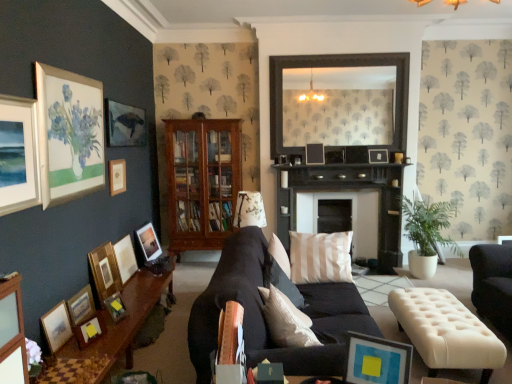
Where is `wooden picture frame at lower left, acting as the 3th picture frame starting from the left`? This screenshot has height=384, width=512. wooden picture frame at lower left, acting as the 3th picture frame starting from the left is located at coordinates (81, 306).

What do you see at coordinates (376, 360) in the screenshot? I see `matte blue picture frame at lower center, the 3th picture frame viewed from the right` at bounding box center [376, 360].

You are a GUI agent. You are given a task and a screenshot of the screen. Output one action in this format:
    pyautogui.click(x=<x>, y=<y>)
    Task: Click on the matte yellow picture frame at lower left, which ranks as the sixth picture frame in right-to-left order
    
    Given the screenshot: What is the action you would take?
    pyautogui.click(x=90, y=330)

The image size is (512, 384). What do you see at coordinates (57, 326) in the screenshot? I see `matte wooden picture frame at lower left, marked as the twelfth picture frame in a right-to-left arrangement` at bounding box center [57, 326].

Locate an element on the screen. The width and height of the screenshot is (512, 384). wooden picture frame at lower left, placed as the 11th picture frame when sorted from right to left is located at coordinates (81, 306).

Is point (403, 59) positioned after point (121, 305)?

Yes.

Can you confirm if black wooden mirror at upper center is wider than matte gold picture frame at lower left, the 5th picture frame viewed from the right?

In fact, black wooden mirror at upper center might be narrower than matte gold picture frame at lower left, the 5th picture frame viewed from the right.

Are black wooden mirror at upper center and matte gold picture frame at lower left, the 5th picture frame viewed from the right, far apart?

Yes, black wooden mirror at upper center is far from matte gold picture frame at lower left, the 5th picture frame viewed from the right.

How much distance is there between black wooden mirror at upper center and matte gold picture frame at lower left, the ninth picture frame positioned from the left?

black wooden mirror at upper center and matte gold picture frame at lower left, the ninth picture frame positioned from the left, are 11.75 feet apart.

From a real-world perspective, relative to green leafy plant at right, is matte gold picture frame at upper left, which is the 4th picture frame in left-to-right order, vertically above or below?

matte gold picture frame at upper left, which is the 4th picture frame in left-to-right order, is above green leafy plant at right.

Is matte gold picture frame at upper left, which is the 4th picture frame in left-to-right order, at the left side of green leafy plant at right?

Correct, you'll find matte gold picture frame at upper left, which is the 4th picture frame in left-to-right order, to the left of green leafy plant at right.

Is matte gold picture frame at upper left, acting as the tenth picture frame starting from the right, behind green leafy plant at right?

No, it is in front of green leafy plant at right.

Which is correct: green leafy plant at right is inside wooden picture frame at upper center, which appears as the 12th picture frame when viewed from the left, or outside of it?

green leafy plant at right is spatially situated outside wooden picture frame at upper center, which appears as the 12th picture frame when viewed from the left.

Which object is positioned more to the left, green leafy plant at right or wooden picture frame at upper center, which appears as the 12th picture frame when viewed from the left?

From the viewer's perspective, wooden picture frame at upper center, which appears as the 12th picture frame when viewed from the left, appears more on the left side.

Who is smaller, green leafy plant at right or wooden picture frame at upper center, marked as the second picture frame in a right-to-left arrangement?

With smaller size is wooden picture frame at upper center, marked as the second picture frame in a right-to-left arrangement.

Is green leafy plant at right turned away from wooden picture frame at upper center, marked as the second picture frame in a right-to-left arrangement?

No, wooden picture frame at upper center, marked as the second picture frame in a right-to-left arrangement, is not at the back of green leafy plant at right.

In terms of width, does matte gold picture frame at upper left, acting as the tenth picture frame starting from the right, look wider or thinner when compared to matte wooden picture frame at lower left, placed as the second picture frame when sorted from left to right?

In the image, matte gold picture frame at upper left, acting as the tenth picture frame starting from the right, appears to be more narrow than matte wooden picture frame at lower left, placed as the second picture frame when sorted from left to right.

How far apart are matte gold picture frame at upper left, acting as the tenth picture frame starting from the right, and matte wooden picture frame at lower left, marked as the twelfth picture frame in a right-to-left arrangement?

The distance of matte gold picture frame at upper left, acting as the tenth picture frame starting from the right, from matte wooden picture frame at lower left, marked as the twelfth picture frame in a right-to-left arrangement, is 4.85 feet.

Is matte wooden picture frame at lower left, marked as the twelfth picture frame in a right-to-left arrangement, completely or partially inside matte gold picture frame at upper left, acting as the tenth picture frame starting from the right?

No, matte wooden picture frame at lower left, marked as the twelfth picture frame in a right-to-left arrangement, is located outside of matte gold picture frame at upper left, acting as the tenth picture frame starting from the right.

Relative to matte wooden picture frame at lower left, marked as the twelfth picture frame in a right-to-left arrangement, is matte gold picture frame at upper left, which is the 4th picture frame in left-to-right order, in front or behind?

matte gold picture frame at upper left, which is the 4th picture frame in left-to-right order, is positioned farther from the viewer than matte wooden picture frame at lower left, marked as the twelfth picture frame in a right-to-left arrangement.

Considering the relative sizes of matte white picture frame at upper left, which is the 1th picture frame from left to right, and beige tufted ottoman at lower right in the image provided, is matte white picture frame at upper left, which is the 1th picture frame from left to right, taller than beige tufted ottoman at lower right?

Correct, matte white picture frame at upper left, which is the 1th picture frame from left to right, is much taller as beige tufted ottoman at lower right.

Is matte white picture frame at upper left, which is the 1th picture frame from left to right, to the left of beige tufted ottoman at lower right from the viewer's perspective?

Yes.

Is the depth of matte white picture frame at upper left, which is counted as the thirteenth picture frame, starting from the right, greater than that of beige tufted ottoman at lower right?

No, matte white picture frame at upper left, which is counted as the thirteenth picture frame, starting from the right, is closer to the viewer.

From a real-world perspective, is matte white picture frame at upper left, which is the 1th picture frame from left to right, under beige tufted ottoman at lower right?

No, from a real-world perspective, matte white picture frame at upper left, which is the 1th picture frame from left to right, is not under beige tufted ottoman at lower right.

You are a GUI agent. You are given a task and a screenshot of the screen. Output one action in this format:
    pyautogui.click(x=<x>, y=<y>)
    Task: Click on the picture frame that is the 8th one when counting downward from the black wooden mirror at upper center (from the image's perspective)
    
    Given the screenshot: What is the action you would take?
    pyautogui.click(x=105, y=271)

How far apart are black wooden mirror at upper center and wooden picture frame at left, placed as the 8th picture frame when sorted from right to left?

black wooden mirror at upper center and wooden picture frame at left, placed as the 8th picture frame when sorted from right to left, are 10.27 feet apart.

Considering the sizes of objects black wooden mirror at upper center and wooden picture frame at left, placed as the 8th picture frame when sorted from right to left, in the image provided, who is smaller, black wooden mirror at upper center or wooden picture frame at left, placed as the 8th picture frame when sorted from right to left,?

wooden picture frame at left, placed as the 8th picture frame when sorted from right to left.

Can you confirm if black wooden mirror at upper center is wider than wooden picture frame at left, the sixth picture frame viewed from the left?

Incorrect, the width of black wooden mirror at upper center does not surpass that of wooden picture frame at left, the sixth picture frame viewed from the left.

Is wooden picture frame at left, which appears as the ninth picture frame when viewed from the right, facing towards matte black picture frame at upper center, acting as the first picture frame starting from the right?

Yes, wooden picture frame at left, which appears as the ninth picture frame when viewed from the right, is facing matte black picture frame at upper center, acting as the first picture frame starting from the right.

Considering the relative positions of wooden picture frame at left, which appears as the ninth picture frame when viewed from the right, and matte black picture frame at upper center, acting as the first picture frame starting from the right, in the image provided, is wooden picture frame at left, which appears as the ninth picture frame when viewed from the right, to the left or to the right of matte black picture frame at upper center, acting as the first picture frame starting from the right,?

From the image, it's evident that wooden picture frame at left, which appears as the ninth picture frame when viewed from the right, is to the left of matte black picture frame at upper center, acting as the first picture frame starting from the right.

In the scene shown: Measure the distance between wooden picture frame at left, which is the fifth picture frame in left-to-right order, and matte black picture frame at upper center, acting as the first picture frame starting from the right.

wooden picture frame at left, which is the fifth picture frame in left-to-right order, is 3.38 meters from matte black picture frame at upper center, acting as the first picture frame starting from the right.

Which is closer, [123,278] or [368,150]?

Point [123,278] appears to be closer to the viewer than point [368,150].

At what (x,y) coordinates should I click in order to perform the action: click on mirror behind the matte gold picture frame at lower left, the 5th picture frame viewed from the right. Please return your answer as a coordinate pair (x, y). Looking at the image, I should click on (336, 66).

Where is `picture frame that is the 1st object located above the green leafy plant at right (from the image's perspective)`? The image size is (512, 384). picture frame that is the 1st object located above the green leafy plant at right (from the image's perspective) is located at coordinates (117, 176).

Looking at the image, which one is located further to matte white picture frame at upper left, which is counted as the thirteenth picture frame, starting from the right, matte wooden picture frame at lower left, marked as the twelfth picture frame in a right-to-left arrangement, or wooden picture frame at left, the sixth picture frame viewed from the left?

Based on the image, wooden picture frame at left, the sixth picture frame viewed from the left, appears to be further to matte white picture frame at upper left, which is counted as the thirteenth picture frame, starting from the right.

From the image, which object appears to be nearer to wooden picture frame at upper center, which appears as the 12th picture frame when viewed from the left, white painted wood fireplace at center or wooden picture frame at lower left, acting as the 3th picture frame starting from the left?

Based on the image, white painted wood fireplace at center appears to be nearer to wooden picture frame at upper center, which appears as the 12th picture frame when viewed from the left.

Looking at this image, which object lies further to the anchor point beige tufted ottoman at lower right, black wooden mirror at upper center or matte yellow picture frame at lower left, which ranks as the sixth picture frame in right-to-left order?

black wooden mirror at upper center.

From the image, which object appears to be farther from mahogany wooden cabinet at center, black wooden mirror at upper center or wooden picture frame at upper center, which appears as the 12th picture frame when viewed from the left?

wooden picture frame at upper center, which appears as the 12th picture frame when viewed from the left, is positioned further to the anchor mahogany wooden cabinet at center.

Looking at the image, which one is located closer to matte blue picture frame at lower center, which appears as the eleventh picture frame when viewed from the left, matte black picture frame at upper center, which is the thirteenth picture frame from left to right, or matte yellow picture frame at lower left, the eighth picture frame from the left?

matte yellow picture frame at lower left, the eighth picture frame from the left, is closer to matte blue picture frame at lower center, which appears as the eleventh picture frame when viewed from the left.

Considering their positions, is wooden picture frame at left, the sixth picture frame viewed from the left, positioned closer to matte gold picture frame at upper left, acting as the tenth picture frame starting from the right, than matte yellow picture frame at lower left, the eighth picture frame from the left?

The object closer to matte gold picture frame at upper left, acting as the tenth picture frame starting from the right, is wooden picture frame at left, the sixth picture frame viewed from the left.

Looking at this image, estimate the real-world distances between objects in this image. Which object is further from matte yellow picture frame at lower left, which ranks as the sixth picture frame in right-to-left order, wooden picture frame at left, which appears as the ninth picture frame when viewed from the right, or wooden picture frame at lower left, acting as the 3th picture frame starting from the left?

Among the two, wooden picture frame at left, which appears as the ninth picture frame when viewed from the right, is located further to matte yellow picture frame at lower left, which ranks as the sixth picture frame in right-to-left order.

Based on their spatial positions, is matte black picture frame at upper center, which ranks as the fourth picture frame in right-to-left order, or matte wooden picture frame at lower left, marked as the twelfth picture frame in a right-to-left arrangement, further from black wooden mirror at upper center?

The object further to black wooden mirror at upper center is matte wooden picture frame at lower left, marked as the twelfth picture frame in a right-to-left arrangement.

At what (x,y) coordinates should I click in order to perform the action: click on fireplace between wooden picture frame at lower left, acting as the 3th picture frame starting from the left, and beige tufted ottoman at lower right. Please return your answer as a coordinate pair (x, y). Image resolution: width=512 pixels, height=384 pixels. Looking at the image, I should click on (352, 218).

What are the coordinates of `cabinetry between wooden picture frame at left, the sixth picture frame viewed from the left, and wooden picture frame at upper center, which appears as the 12th picture frame when viewed from the left, in the horizontal direction` in the screenshot? It's located at [201, 181].

Locate an element on the screen. This screenshot has width=512, height=384. plant between matte blue picture frame at lower center, which appears as the eleventh picture frame when viewed from the left, and black wooden mirror at upper center in the front-back direction is located at coordinates (428, 227).

Where is `fireplace between matte gold picture frame at upper left, which is the 4th picture frame in left-to-right order, and matte black picture frame at upper center, which is the thirteenth picture frame from left to right, in the horizontal direction`? Image resolution: width=512 pixels, height=384 pixels. fireplace between matte gold picture frame at upper left, which is the 4th picture frame in left-to-right order, and matte black picture frame at upper center, which is the thirteenth picture frame from left to right, in the horizontal direction is located at coordinates (352, 218).